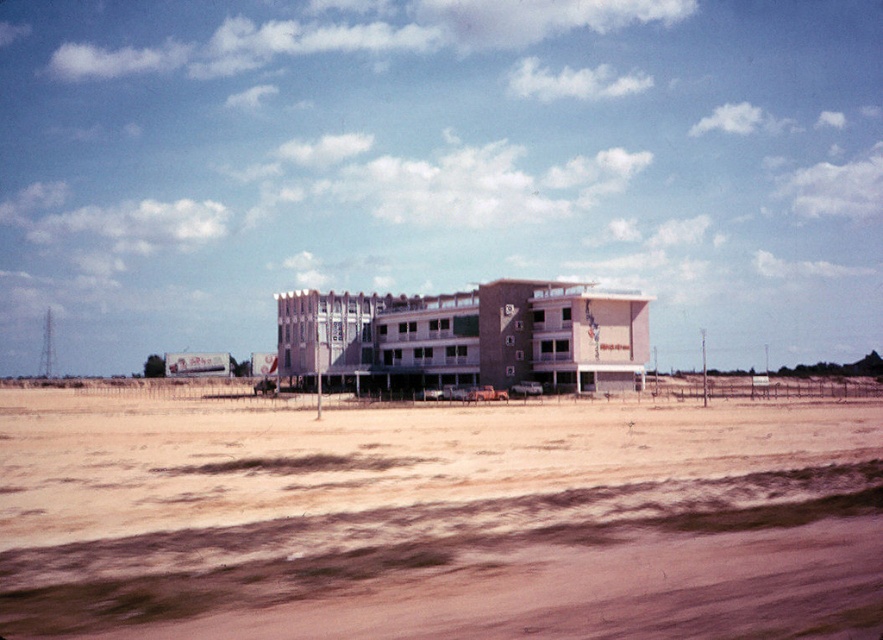
Question: Can you confirm if brown sandy dirt field at lower center is positioned below beige brick hotel at center?

Choices:
 (A) no
 (B) yes

Answer: (B)

Question: Is brown sandy dirt field at lower center behind beige brick hotel at center?

Choices:
 (A) no
 (B) yes

Answer: (A)

Question: Which point is farther from the camera taking this photo?

Choices:
 (A) (585, 362)
 (B) (401, 580)

Answer: (A)

Question: Is brown sandy dirt field at lower center below beige brick hotel at center?

Choices:
 (A) no
 (B) yes

Answer: (B)

Question: Among these objects, which one is nearest to the camera?

Choices:
 (A) brown sandy dirt field at lower center
 (B) beige brick hotel at center

Answer: (A)